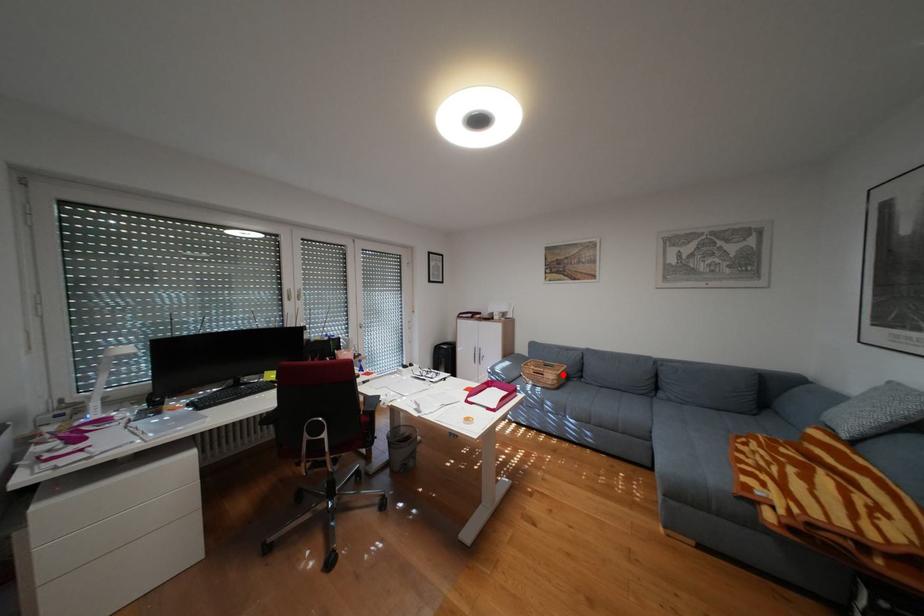
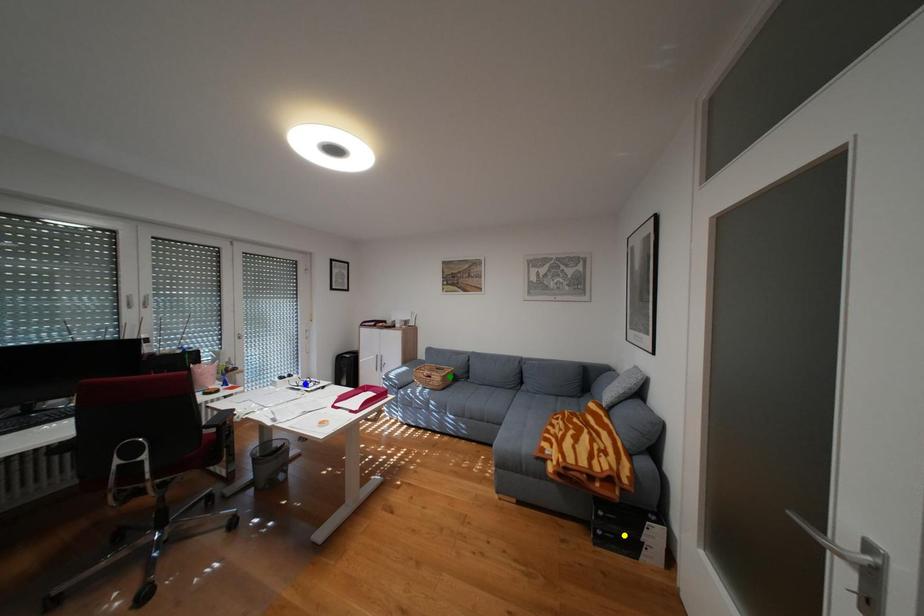
Question: I am providing you with two images of the same scene from different viewpoints. A red point is marked on the first image. You are given multiple points on the second image. Which point in image 2 is actually the same real-world point as the red point in image 1?

Choices:
 (A) green point
 (B) blue point
 (C) yellow point

Answer: (A)